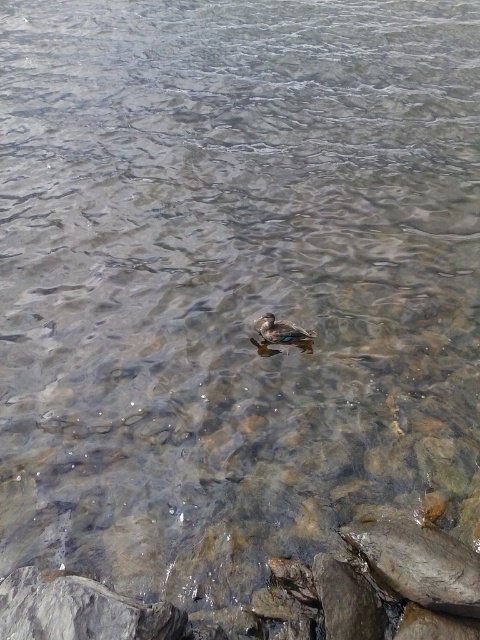
You are standing at the edge of the water and want to place a small pebble on the gray rough rock at lower left. What are the coordinates where you should aim to place it?

The coordinates for the gray rough rock at lower left are at point (x=79, y=611), so you should aim for those coordinates to place the small pebble there.

You are standing at the edge of the water and see the gray rough rock at lower left. Based on its position, can you determine if it is closer to you or further away compared to the duck in the center?

The gray rough rock at lower left is located at point coordinates closer to the lower edge of the image, which typically corresponds to being further away from the observer in such scenes. However, since the duck is explicitly mentioned as being in the center, the rock at lower left might actually be positioned closer to the viewer. Without depth information, it is challenging to determine definitively based solely on coordinates. However, given the standard perspective where lower elements are often in the